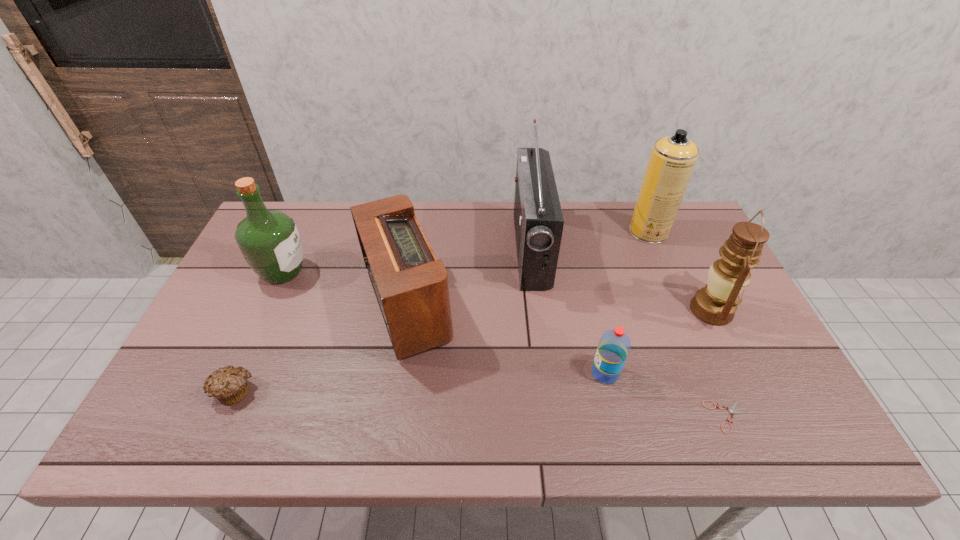
The width and height of the screenshot is (960, 540). I want to click on shears located at the right edge, so click(731, 410).

Where is `object at the far right corner`? This screenshot has width=960, height=540. object at the far right corner is located at coordinates (672, 160).

I want to click on object present at the near right corner, so click(x=731, y=410).

Locate an element on the screen. vacant area at the far edge is located at coordinates 468,244.

You are a GUI agent. You are given a task and a screenshot of the screen. Output one action in this format:
    pyautogui.click(x=<x>, y=<y>)
    Task: Click on the vacant space at the near edge
    The image size is (960, 540).
    Given the screenshot: What is the action you would take?
    pyautogui.click(x=540, y=432)

Locate an element on the screen. The image size is (960, 540). vacant space at the left edge of the desktop is located at coordinates (262, 312).

At what (x,y) coordinates should I click in order to perform the action: click on vacant point at the right edge. Please return your answer as a coordinate pair (x, y). Looking at the image, I should click on (763, 401).

Where is `free space between the fifth object from left to right and the muffin`? The height and width of the screenshot is (540, 960). free space between the fifth object from left to right and the muffin is located at coordinates (420, 382).

The image size is (960, 540). What are the coordinates of `free space between the shortest object and the liquor` in the screenshot? It's located at (506, 345).

The image size is (960, 540). Find the location of `vacant region between the oil lamp and the shortest object`. vacant region between the oil lamp and the shortest object is located at coordinates (720, 363).